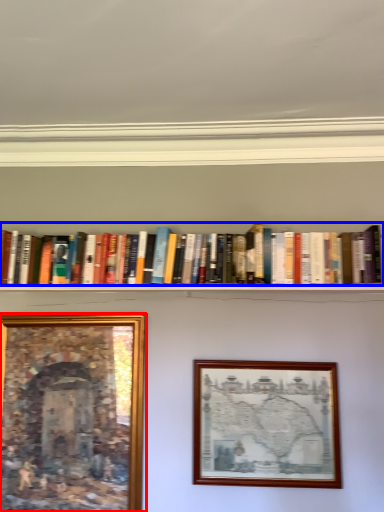
Question: Which object is further to the camera taking this photo, picture frame (highlighted by a red box) or book (highlighted by a blue box)?

Choices:
 (A) picture frame
 (B) book

Answer: (A)